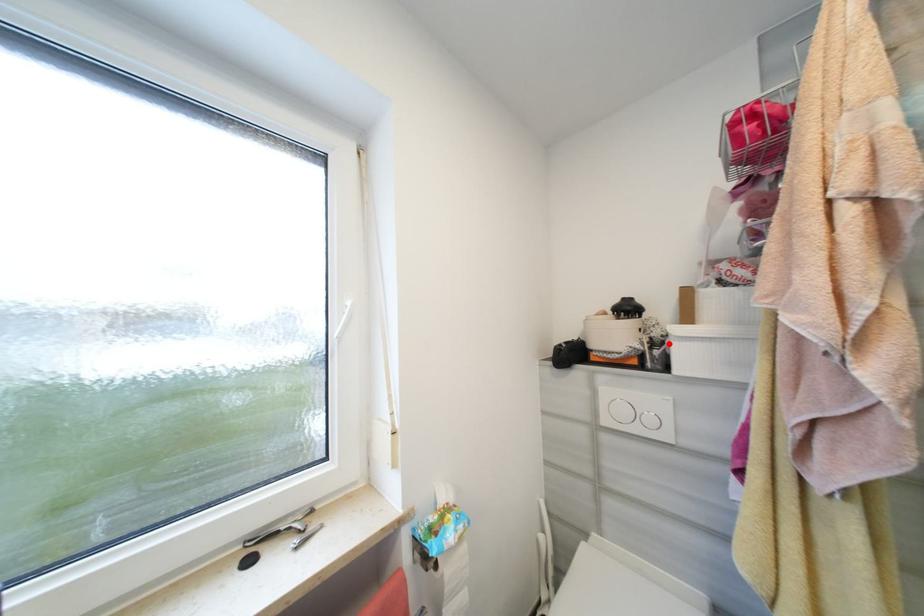
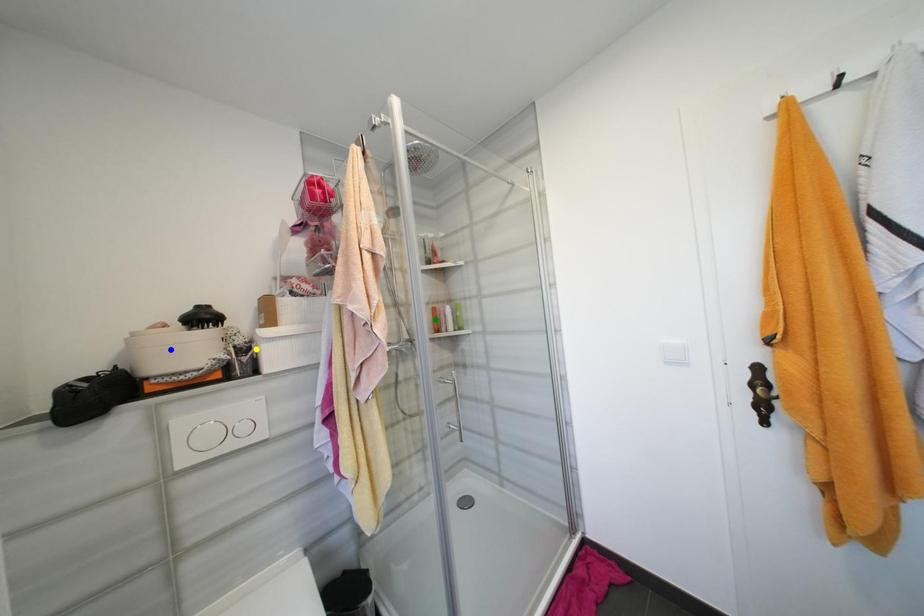
Question: I am providing you with two images of the same scene from different viewpoints. A red point is marked on the first image. You are given multiple points on the second image. In image 2, which mark is for the same physical point as the one in image 1?

Choices:
 (A) blue point
 (B) green point
 (C) yellow point

Answer: (C)